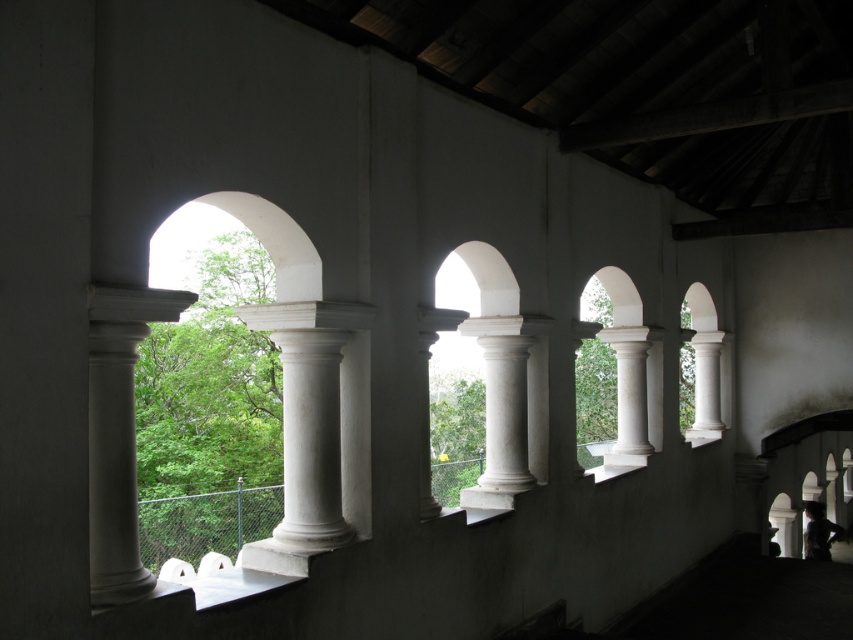
Question: Which of the following is the farthest from the observer?

Choices:
 (A) white marble column at center
 (B) white marble column at left

Answer: (A)

Question: Does white marble column at left appear on the right side of white marble column at center?

Choices:
 (A) yes
 (B) no

Answer: (B)

Question: Can you confirm if white marble column at left is bigger than white marble column at center?

Choices:
 (A) yes
 (B) no

Answer: (B)

Question: Which object appears farthest from the camera in this image?

Choices:
 (A) white marble column at left
 (B) white marble column at center

Answer: (B)

Question: Can you confirm if white marble column at left is wider than white marble column at center?

Choices:
 (A) no
 (B) yes

Answer: (A)